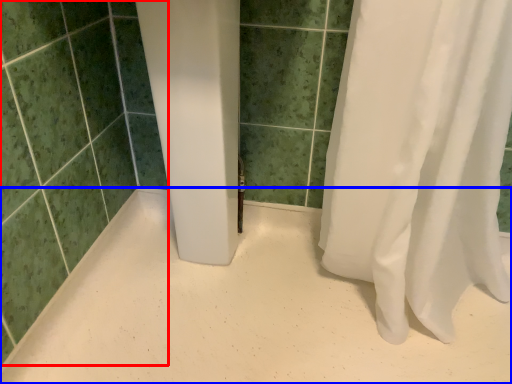
Question: Which of the following is the closest to the observer, ceramic tile (highlighted by a red box) or plain (highlighted by a blue box)?

Choices:
 (A) ceramic tile
 (B) plain

Answer: (A)